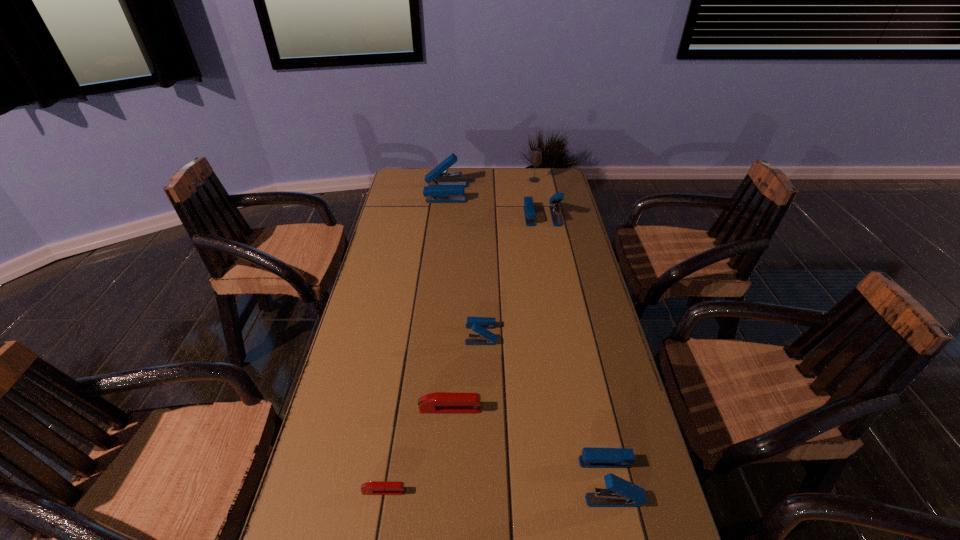
The height and width of the screenshot is (540, 960). Identify the location of glass drink container. (536, 154).

At what (x,y) coordinates should I click in order to perform the action: click on the tallest stapler. Please return your answer as a coordinate pair (x, y). Looking at the image, I should click on (437, 191).

Where is `the biggest blue stapler`? This screenshot has width=960, height=540. the biggest blue stapler is located at coordinates (437, 191).

Image resolution: width=960 pixels, height=540 pixels. Find the location of `the third tallest object`. the third tallest object is located at coordinates (529, 210).

Identify the location of the second farthest stapler. (529, 210).

Locate an element on the screen. Image resolution: width=960 pixels, height=540 pixels. the third tallest stapler is located at coordinates (619, 493).

This screenshot has width=960, height=540. Identify the location of the nearest blue stapler. (619, 493).

Find the location of a particular element. the third shortest stapler is located at coordinates (479, 325).

Find the location of a particular element. This screenshot has width=960, height=540. the third blue stapler from right to left is located at coordinates pyautogui.click(x=479, y=325).

The image size is (960, 540). What are the coordinates of `the fifth tallest stapler` in the screenshot? It's located at (439, 402).